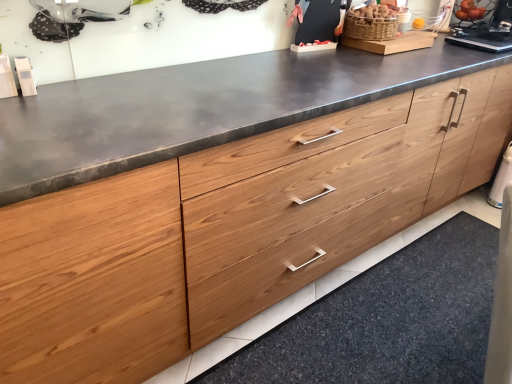
I want to click on blank space situated above natural wood drawer at lower center (from a real-world perspective), so click(408, 319).